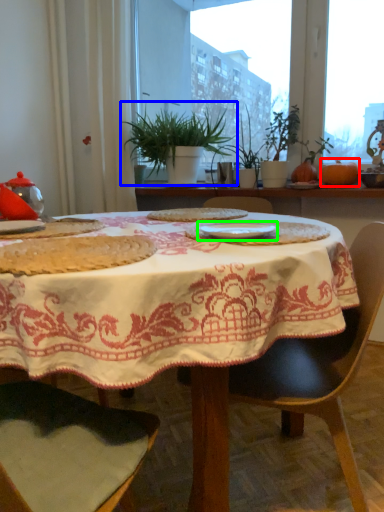
Question: Estimate the real-world distances between objects in this image. Which object is closer to pumpkin (highlighted by a red box), houseplant (highlighted by a blue box) or tableware (highlighted by a green box)?

Choices:
 (A) houseplant
 (B) tableware

Answer: (A)